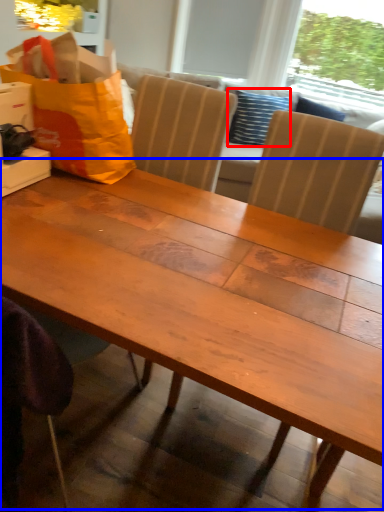
Question: Among these objects, which one is farthest to the camera, pillow (highlighted by a red box) or table (highlighted by a blue box)?

Choices:
 (A) pillow
 (B) table

Answer: (A)